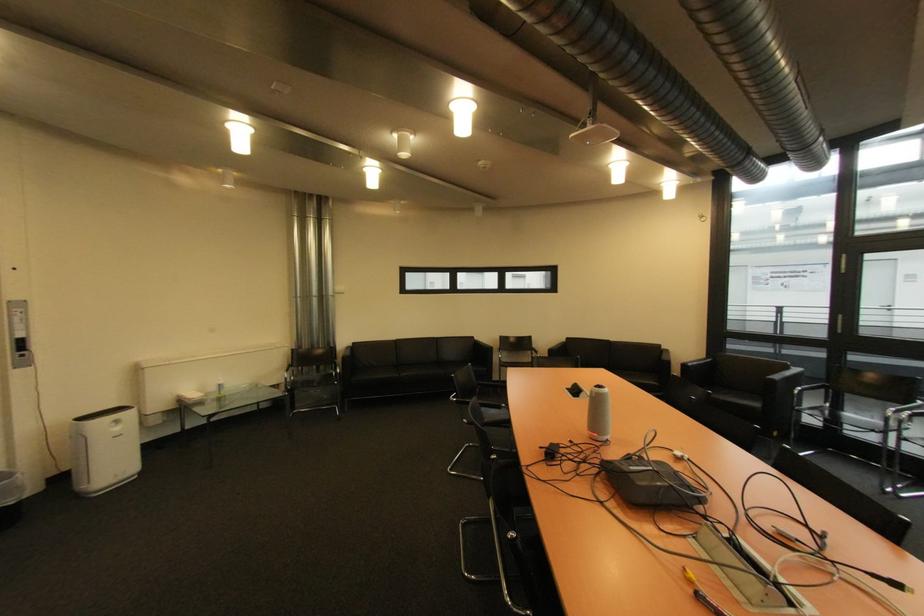
Identify the location of black trash can. (10, 493).